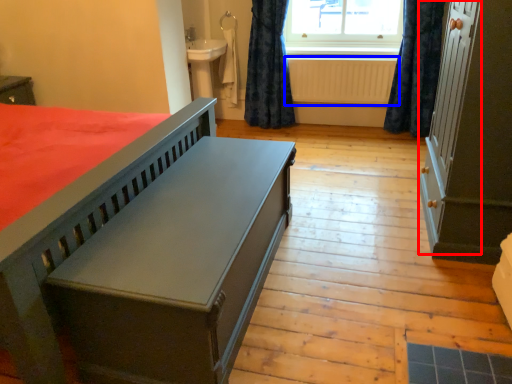
Question: Which object appears farthest to the camera in this image, screen door (highlighted by a red box) or radiator (highlighted by a blue box)?

Choices:
 (A) screen door
 (B) radiator

Answer: (B)